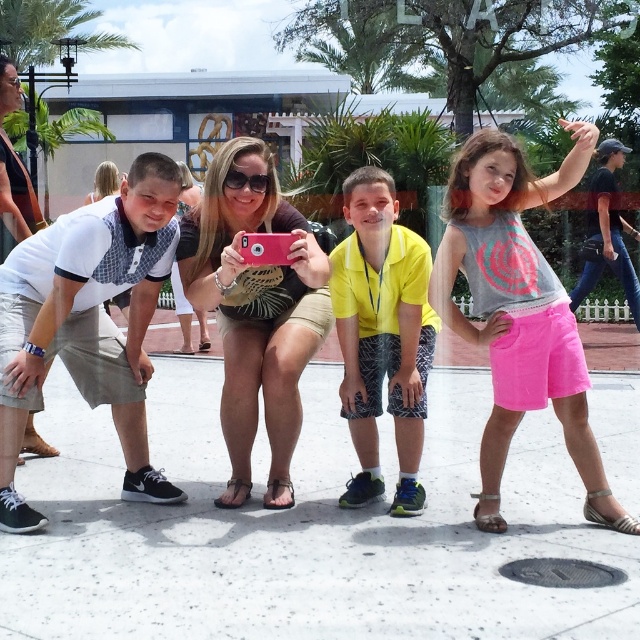
In the scene shown: Which is more to the right, beige textured shorts at center or light gray shorts at left?

Positioned to the right is beige textured shorts at center.

Does beige textured shorts at center appear under light gray shorts at left?

Correct, beige textured shorts at center is located below light gray shorts at left.

Does point (225, 292) lie in front of point (26, 179)?

Yes.

Locate an element on the screen. The height and width of the screenshot is (640, 640). beige textured shorts at center is located at coordinates (256, 308).

Locate an element on the screen. The image size is (640, 640). pink cotton shorts at center is located at coordinates (518, 310).

Between pink cotton shorts at center and light gray shorts at left, which one appears on the right side from the viewer's perspective?

pink cotton shorts at center is more to the right.

Image resolution: width=640 pixels, height=640 pixels. What do you see at coordinates (518, 310) in the screenshot?
I see `pink cotton shorts at center` at bounding box center [518, 310].

I want to click on pink cotton shorts at center, so click(x=518, y=310).

Can you confirm if pink cotton shorts at center is bigger than denim jeans at upper right?

No, pink cotton shorts at center is not bigger than denim jeans at upper right.

Describe the element at coordinates (518, 310) in the screenshot. I see `pink cotton shorts at center` at that location.

In the scene shown: Measure the distance between point (448, 300) and camera.

Point (448, 300) is 4.63 meters from camera.

Find the location of `pink cotton shorts at center`. pink cotton shorts at center is located at coordinates (518, 310).